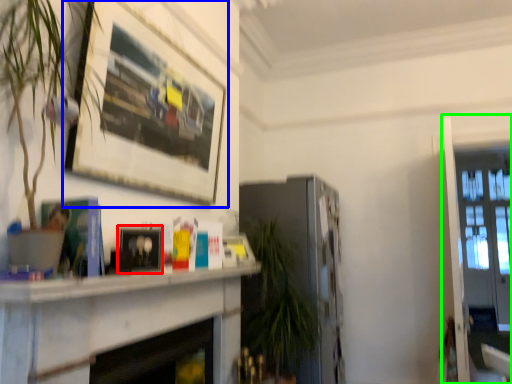
Question: Which object is the closest to the picture frame (highlighted by a red box)? Choose among these: picture frame (highlighted by a blue box) or glass door (highlighted by a green box).

Choices:
 (A) picture frame
 (B) glass door

Answer: (A)